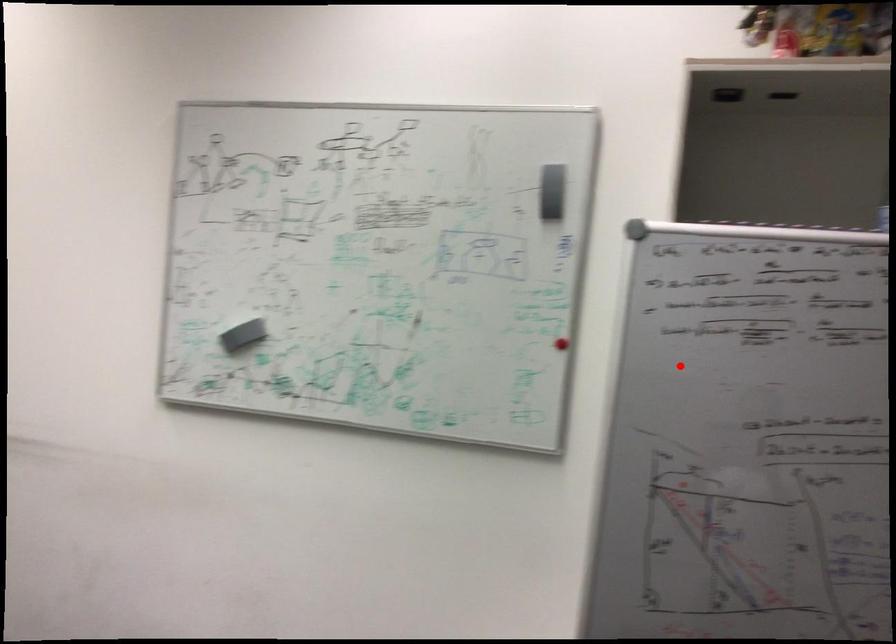
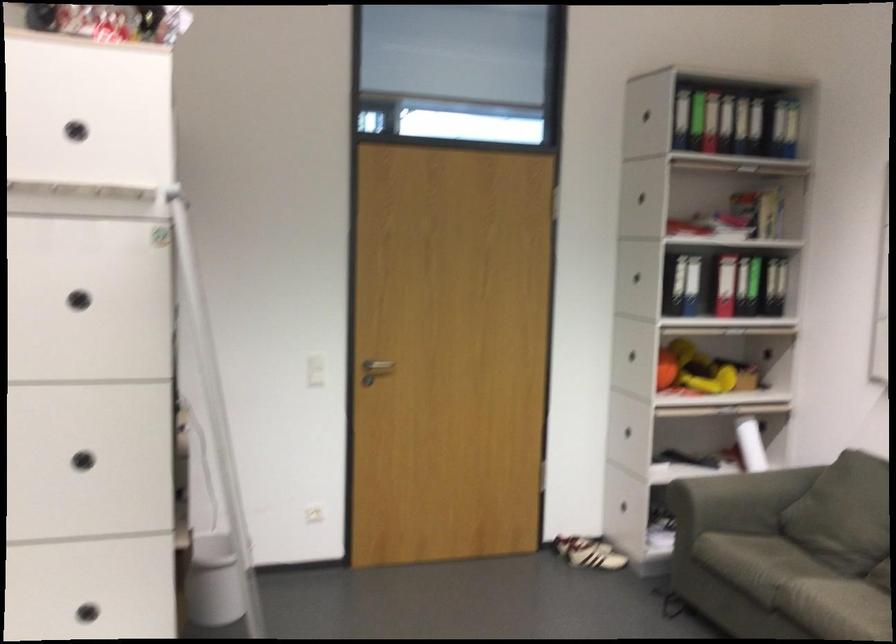
The point at the highlighted location is marked in the first image. Where is the corresponding point in the second image?

(80, 288)